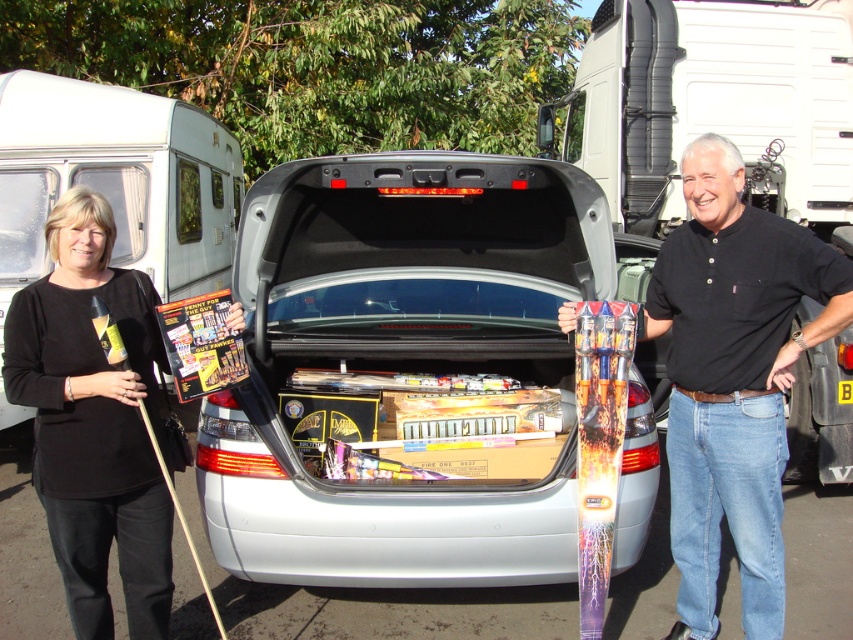
This screenshot has width=853, height=640. What do you see at coordinates (405, 371) in the screenshot?
I see `silver metallic car trunk at center` at bounding box center [405, 371].

Who is more distant from viewer, (294, 348) or (836, 442)?

The point (836, 442) is more distant.

Is point (444, 193) farther from viewer compared to point (787, 467)?

That is False.

Locate an element on the screen. silver metallic car trunk at center is located at coordinates (405, 371).

Is silver metallic car trunk at center wider than black fabric shirt at left?

Yes, silver metallic car trunk at center is wider than black fabric shirt at left.

Which of these two, silver metallic car trunk at center or black fabric shirt at left, stands shorter?

With less height is black fabric shirt at left.

Consider the image. Measure the distance between point (409, 228) and camera.

Point (409, 228) is 4.22 meters from camera.

The width and height of the screenshot is (853, 640). Find the location of `silver metallic car trunk at center`. silver metallic car trunk at center is located at coordinates (405, 371).

Based on the photo, does black fabric shirt at left have a lesser width compared to metallic silver car trunk at center?

Incorrect, black fabric shirt at left's width is not less than metallic silver car trunk at center's.

The height and width of the screenshot is (640, 853). What do you see at coordinates (94, 420) in the screenshot? I see `black fabric shirt at left` at bounding box center [94, 420].

At what (x,y) coordinates should I click in order to perform the action: click on black fabric shirt at left. Please return your answer as a coordinate pair (x, y). The image size is (853, 640). Looking at the image, I should click on pyautogui.click(x=94, y=420).